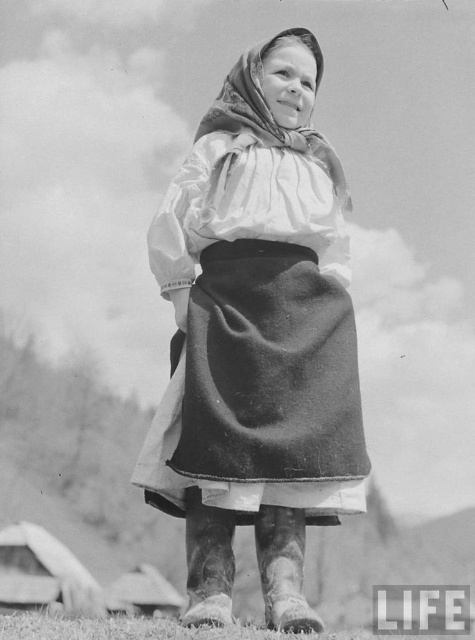
Does white cotton blouse at center have a smaller size compared to soft white scarf at center?

No, white cotton blouse at center is not smaller than soft white scarf at center.

Between white cotton blouse at center and soft white scarf at center, which one is positioned lower?

white cotton blouse at center

Is point (173, 472) behind point (294, 131)?

No, (173, 472) is closer to viewer.

Find the location of a particular element. The image size is (475, 640). white cotton blouse at center is located at coordinates (256, 339).